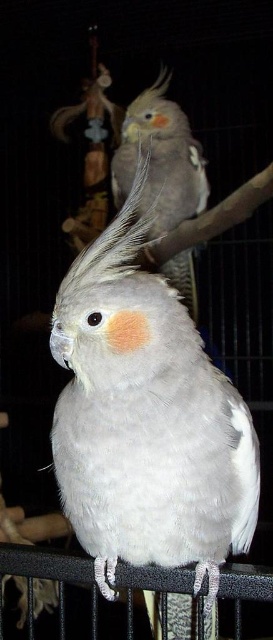
This screenshot has height=640, width=273. What do you see at coordinates (146, 419) in the screenshot?
I see `white feathered parrot at center` at bounding box center [146, 419].

Who is shorter, white feathered parrot at center or gray feathered parrot at upper center?

white feathered parrot at center

Where is `white feathered parrot at center`? Image resolution: width=273 pixels, height=640 pixels. white feathered parrot at center is located at coordinates (x=146, y=419).